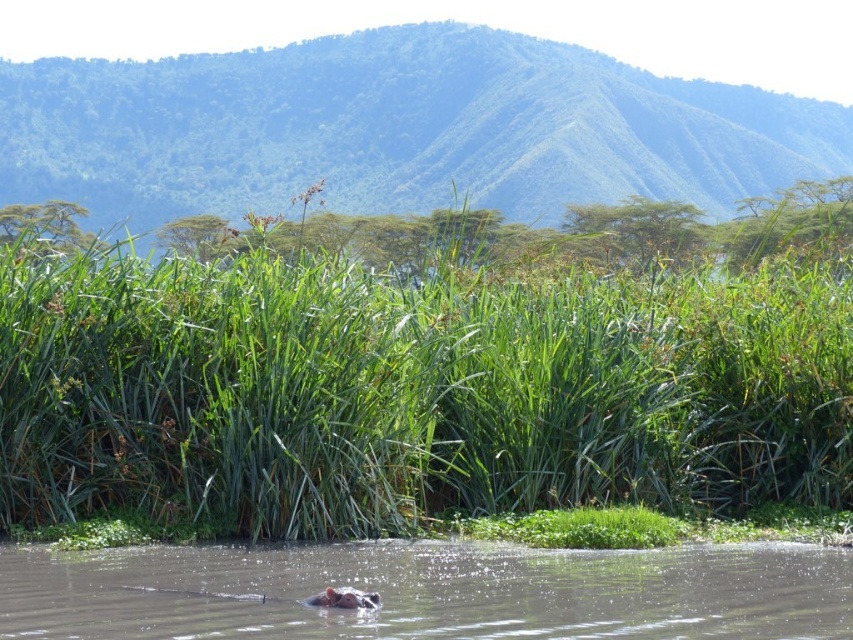
Can you confirm if green grassy reeds at center is taller than brown muddy water at lower center?

Yes, green grassy reeds at center is taller than brown muddy water at lower center.

Can you confirm if green grassy reeds at center is shorter than brown muddy water at lower center?

Incorrect, green grassy reeds at center's height does not fall short of brown muddy water at lower center's.

Is point (747, 490) more distant than point (33, 609)?

Yes, point (747, 490) is behind point (33, 609).

Image resolution: width=853 pixels, height=640 pixels. Identify the location of green grassy reeds at center. (432, 372).

Which of these two, brown muddy water at lower center or green matte hippo at lower center, stands shorter?

With less height is brown muddy water at lower center.

Does brown muddy water at lower center have a greater height compared to green matte hippo at lower center?

No.

The image size is (853, 640). What are the coordinates of `brown muddy water at lower center` in the screenshot? It's located at (431, 592).

Does green grassy reeds at center appear over green matte hippo at lower center?

Yes.

Where is `green grassy reeds at center`? This screenshot has width=853, height=640. green grassy reeds at center is located at coordinates (432, 372).

Find the location of `green grassy reeds at center`. green grassy reeds at center is located at coordinates (432, 372).